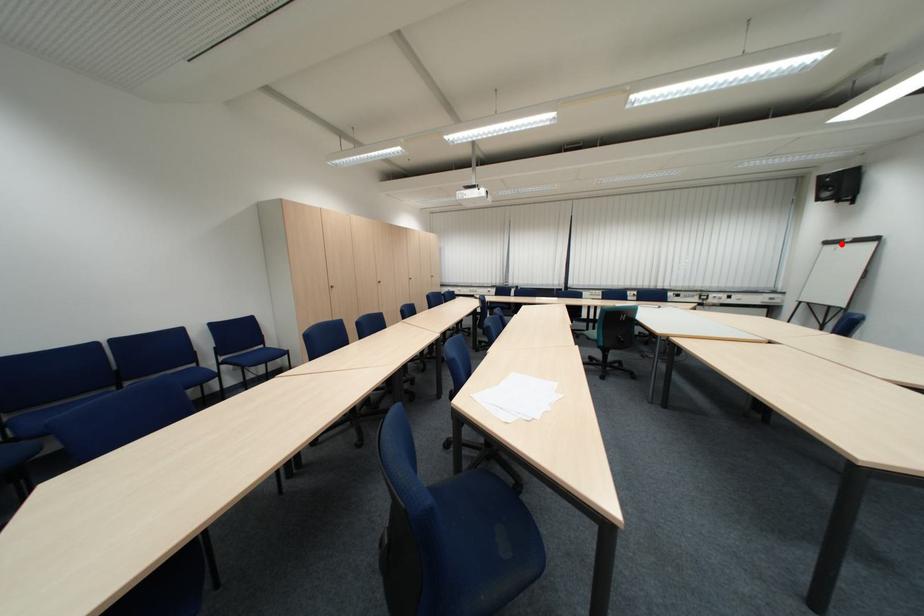
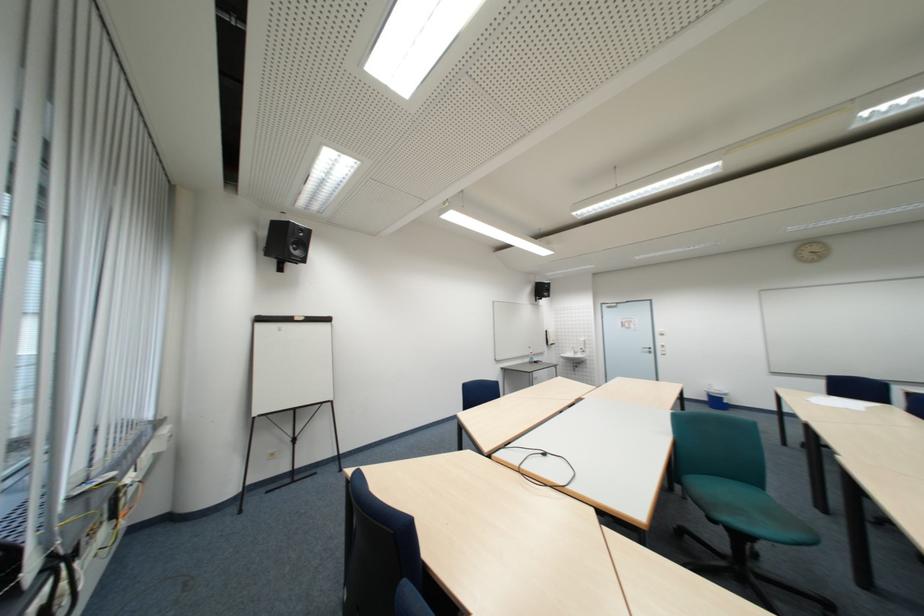
In the second image, find the point that corresponds to the highlighted location in the first image.

(273, 321)